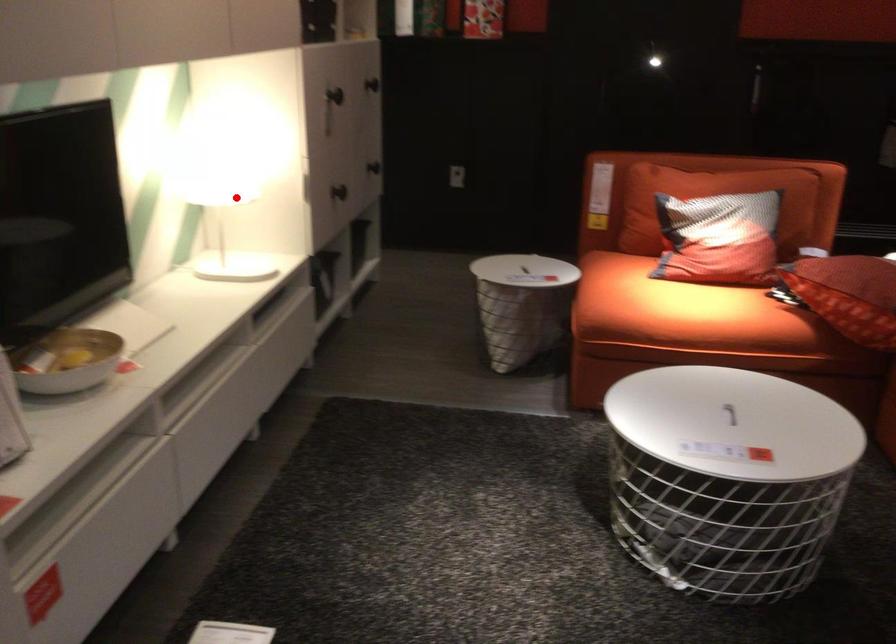
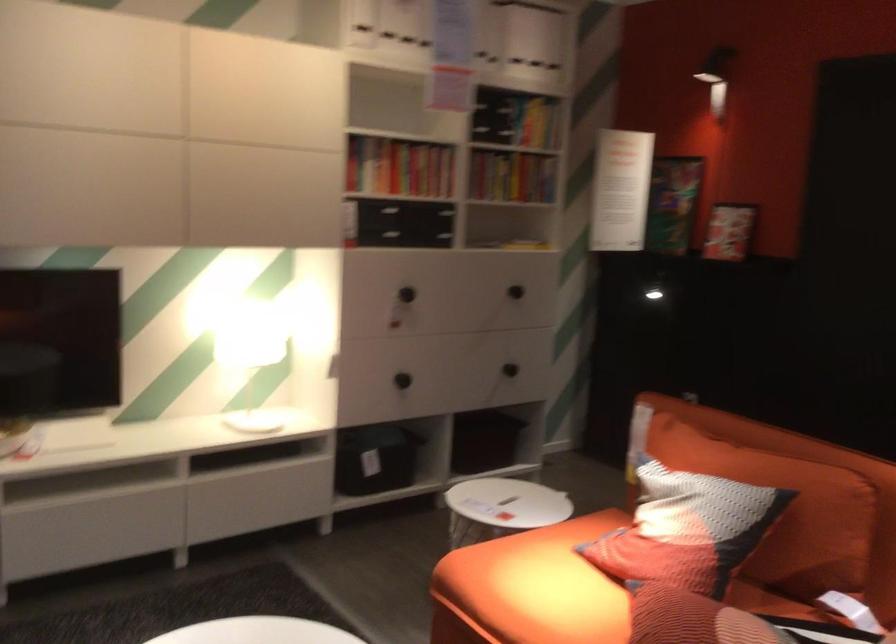
Where in the second image is the point corresponding to the highlighted location from the first image?

(250, 354)